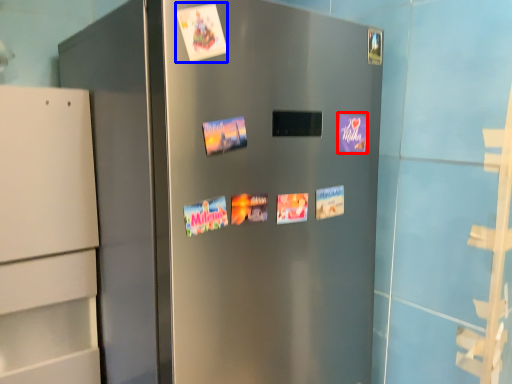
Question: Which of the following is the farthest to the observer, postcard (highlighted by a red box) or flyer (highlighted by a blue box)?

Choices:
 (A) postcard
 (B) flyer

Answer: (A)